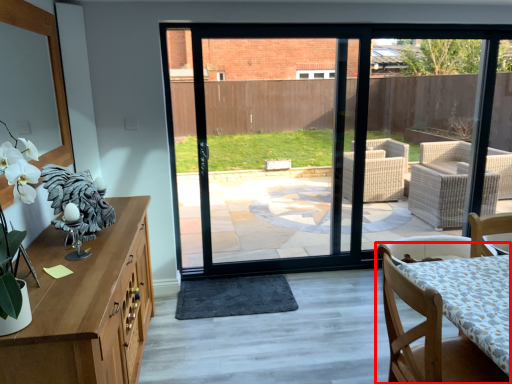
Question: Observing the image, what is the correct spatial positioning of chair (annotated by the red box) in reference to wide?

Choices:
 (A) right
 (B) left

Answer: (A)